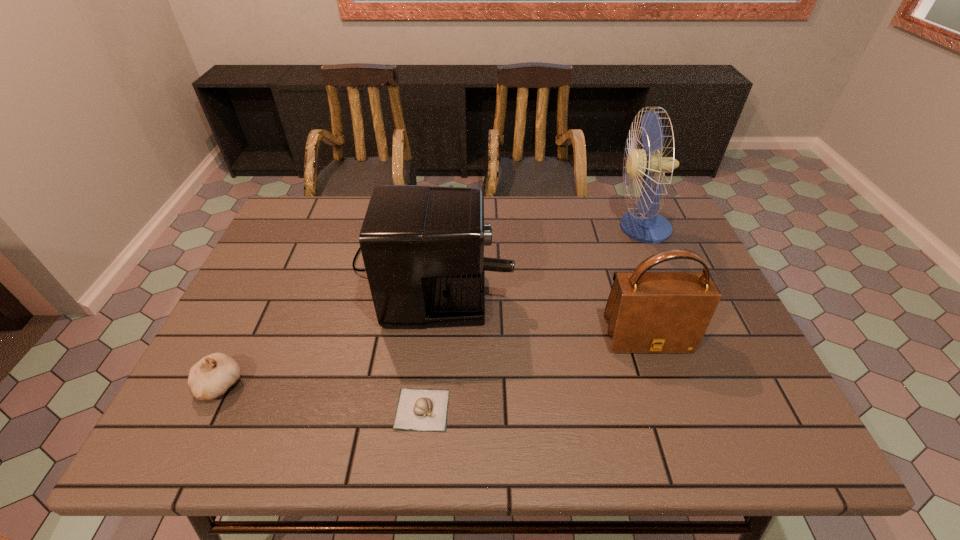
Locate an element on the screen. The image size is (960, 540). object located at the far right corner is located at coordinates (644, 225).

Where is `vacant space at the far edge of the desktop`? vacant space at the far edge of the desktop is located at coordinates (574, 196).

Find the location of a particular element. The width and height of the screenshot is (960, 540). vacant space at the near edge of the desktop is located at coordinates (678, 430).

Find the location of a particular element. The image size is (960, 540). vacant region at the left edge of the desktop is located at coordinates (263, 371).

Where is `free spot at the right edge of the desktop`? free spot at the right edge of the desktop is located at coordinates (763, 376).

In the image, there is a desktop. Where is `free space at the far left corner`? The width and height of the screenshot is (960, 540). free space at the far left corner is located at coordinates (301, 214).

What are the coordinates of `free point at the near right corner` in the screenshot? It's located at (769, 427).

In order to click on free area in between the shoulder bag and the leftmost object in this screenshot , I will do `click(433, 361)`.

You are a GUI agent. You are given a task and a screenshot of the screen. Output one action in this format:
    pyautogui.click(x=<x>, y=<y>)
    Task: Click on the unoccupied position between the coffee maker and the right garlic
    This screenshot has width=960, height=540.
    Given the screenshot: What is the action you would take?
    pyautogui.click(x=427, y=335)

I want to click on free point between the shoulder bag and the coffee maker, so click(x=540, y=299).